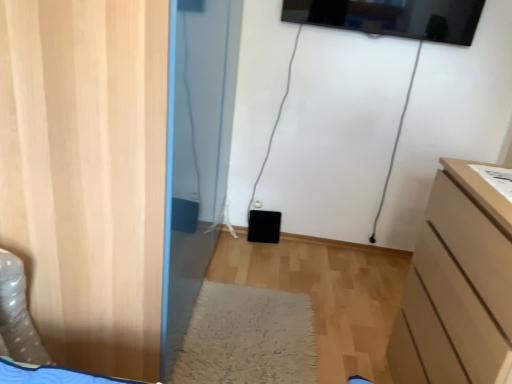
Describe the element at coordinates (247, 337) in the screenshot. Image resolution: width=512 pixels, height=384 pixels. I see `white shaggy rug at center` at that location.

Describe the element at coordinates (458, 286) in the screenshot. I see `matte beige chest of drawers at right` at that location.

The height and width of the screenshot is (384, 512). Identify the location of white shaggy rug at center. (247, 337).

Find the location of a particular element. mat lying on the right of wooden door at left is located at coordinates (247, 337).

Considering the relative sizes of white shaggy rug at center and wooden door at left in the image provided, is white shaggy rug at center thinner than wooden door at left?

No, white shaggy rug at center is not thinner than wooden door at left.

Which object is further away from the camera taking this photo, white shaggy rug at center or wooden door at left?

white shaggy rug at center is further from the camera.

Is white shaggy rug at center looking in the opposite direction of wooden door at left?

No, white shaggy rug at center is not facing the opposite direction of wooden door at left.

Does white shaggy rug at center come in front of matte beige chest of drawers at right?

No.

Is white shaggy rug at center wider or thinner than matte beige chest of drawers at right?

Clearly, white shaggy rug at center has more width compared to matte beige chest of drawers at right.

From the image's perspective, does white shaggy rug at center appear higher than matte beige chest of drawers at right?

Incorrect, from the image's perspective, white shaggy rug at center is lower than matte beige chest of drawers at right.

Does point (108, 168) appear closer or farther from the camera than point (264, 290)?

Point (108, 168).

Is wooden door at left further to the viewer compared to white shaggy rug at center?

No, the depth of wooden door at left is less than that of white shaggy rug at center.

From the image's perspective, relative to white shaggy rug at center, is wooden door at left above or below?

wooden door at left is above white shaggy rug at center.

In the scene shown: Does wooden door at left turn towards white shaggy rug at center?

Yes.

Can you see matte beige chest of drawers at right touching white shaggy rug at center?

No.

Is point (467, 170) in front of point (248, 344)?

Yes.

Identify the location of mat on the left of matte beige chest of drawers at right. The height and width of the screenshot is (384, 512). (247, 337).

Is matte beige chest of drawers at right bigger or smaller than white shaggy rug at center?

In the image, matte beige chest of drawers at right appears to be larger than white shaggy rug at center.

Considering the positions of objects matte beige chest of drawers at right and wooden door at left in the image provided, who is more to the left, matte beige chest of drawers at right or wooden door at left?

wooden door at left.

From the picture: Between matte beige chest of drawers at right and wooden door at left, which one has larger size?

wooden door at left is bigger.

Which is nearer, (485, 233) or (62, 99)?

Point (485, 233).

From a real-world perspective, is wooden door at left positioned above or below matte beige chest of drawers at right?

From a real-world perspective, wooden door at left is physically above matte beige chest of drawers at right.

Looking at this image, which is correct: wooden door at left is inside matte beige chest of drawers at right, or outside of it?

wooden door at left is spatially situated outside matte beige chest of drawers at right.

Can you confirm if wooden door at left is wider than matte beige chest of drawers at right?

Yes, wooden door at left is wider than matte beige chest of drawers at right.

Identify the location of door above the white shaggy rug at center (from the image's perspective). (87, 174).

Identify the location of mat on the left of matte beige chest of drawers at right. (247, 337).

Estimate the real-world distances between objects in this image. Which object is closer to white shaggy rug at center, wooden door at left or matte beige chest of drawers at right?

matte beige chest of drawers at right.

Considering their positions, is wooden door at left positioned closer to matte beige chest of drawers at right than white shaggy rug at center?

Based on the image, white shaggy rug at center appears to be nearer to matte beige chest of drawers at right.

From the image, which object appears to be nearer to wooden door at left, white shaggy rug at center or matte beige chest of drawers at right?

white shaggy rug at center is closer to wooden door at left.

From the image, which object appears to be nearer to wooden door at left, matte beige chest of drawers at right or white shaggy rug at center?

white shaggy rug at center lies closer to wooden door at left than the other object.

Looking at the image, which one is located further to white shaggy rug at center, matte beige chest of drawers at right or wooden door at left?

wooden door at left is further to white shaggy rug at center.

Based on their spatial positions, is white shaggy rug at center or wooden door at left further from matte beige chest of drawers at right?

wooden door at left lies further to matte beige chest of drawers at right than the other object.

Find the location of a particular element. The height and width of the screenshot is (384, 512). mat situated between wooden door at left and matte beige chest of drawers at right from left to right is located at coordinates (247, 337).